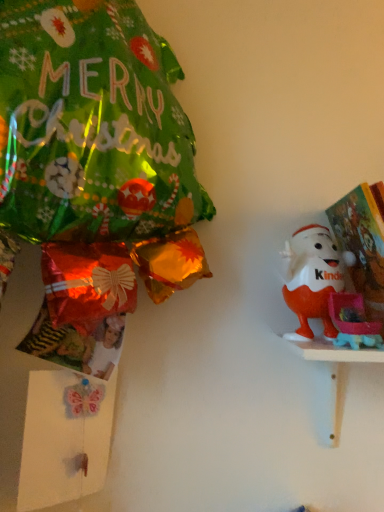
Question: From the image's perspective, would you say white wooden shelf at right is positioned over orange matte kinder egg at right?

Choices:
 (A) yes
 (B) no

Answer: (B)

Question: From the image's perspective, is white wooden shelf at right under orange matte kinder egg at right?

Choices:
 (A) no
 (B) yes

Answer: (B)

Question: Is white wooden shelf at right aimed at orange matte kinder egg at right?

Choices:
 (A) yes
 (B) no

Answer: (B)

Question: Is white wooden shelf at right not inside orange matte kinder egg at right?

Choices:
 (A) no
 (B) yes

Answer: (B)

Question: Is orange matte kinder egg at right inside white wooden shelf at right?

Choices:
 (A) no
 (B) yes

Answer: (A)

Question: Can you confirm if white wooden shelf at right is bigger than orange matte kinder egg at right?

Choices:
 (A) no
 (B) yes

Answer: (B)

Question: Is orange matte kinder egg at right bigger than white wooden shelf at right?

Choices:
 (A) yes
 (B) no

Answer: (B)

Question: From the image's perspective, is orange matte kinder egg at right on top of white wooden shelf at right?

Choices:
 (A) no
 (B) yes

Answer: (B)

Question: Can you confirm if orange matte kinder egg at right is positioned to the right of white wooden shelf at right?

Choices:
 (A) yes
 (B) no

Answer: (B)

Question: Does orange matte kinder egg at right have a lesser height compared to white wooden shelf at right?

Choices:
 (A) no
 (B) yes

Answer: (A)

Question: From a real-world perspective, is orange matte kinder egg at right beneath white wooden shelf at right?

Choices:
 (A) no
 (B) yes

Answer: (A)

Question: Does orange matte kinder egg at right turn towards white wooden shelf at right?

Choices:
 (A) yes
 (B) no

Answer: (B)

Question: From the image's perspective, is orange matte kinder egg at right located above or below white wooden shelf at right?

Choices:
 (A) below
 (B) above

Answer: (B)